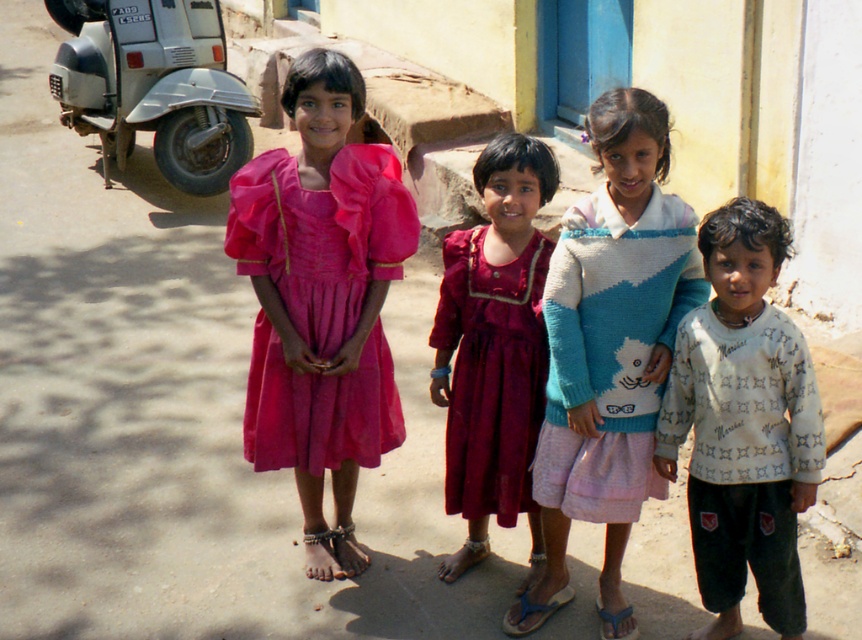
Question: Which of the following is the farthest from the observer?

Choices:
 (A) knitted sweater at center
 (B) silver metallic scooter at left

Answer: (B)

Question: Which point appears closest to the camera in this image?

Choices:
 (A) coord(788,529)
 (B) coord(245,113)
 (C) coord(610,403)

Answer: (A)

Question: Which object appears closest to the camera in this image?

Choices:
 (A) matte pink fabric dress at center
 (B) burgundy satin dress at center
 (C) white printed sweater at right
 (D) silver metallic scooter at left

Answer: (C)

Question: Is silver metallic scooter at left to the left of burgundy satin dress at center from the viewer's perspective?

Choices:
 (A) yes
 (B) no

Answer: (A)

Question: Is white printed sweater at right below burgundy satin dress at center?

Choices:
 (A) yes
 (B) no

Answer: (A)

Question: Does matte pink fabric dress at center have a larger size compared to silver metallic scooter at left?

Choices:
 (A) no
 (B) yes

Answer: (A)